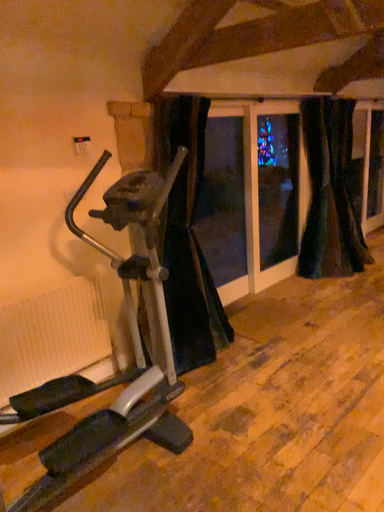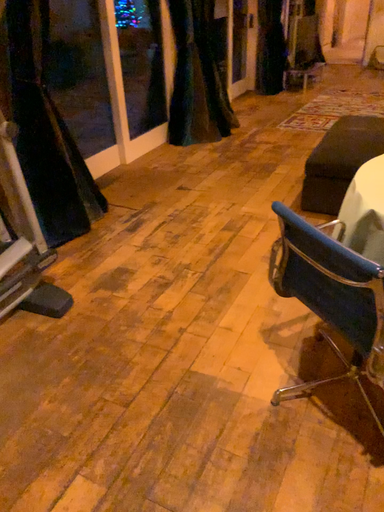
Question: How did the camera likely rotate when shooting the video?

Choices:
 (A) rotated upward
 (B) rotated downward

Answer: (B)